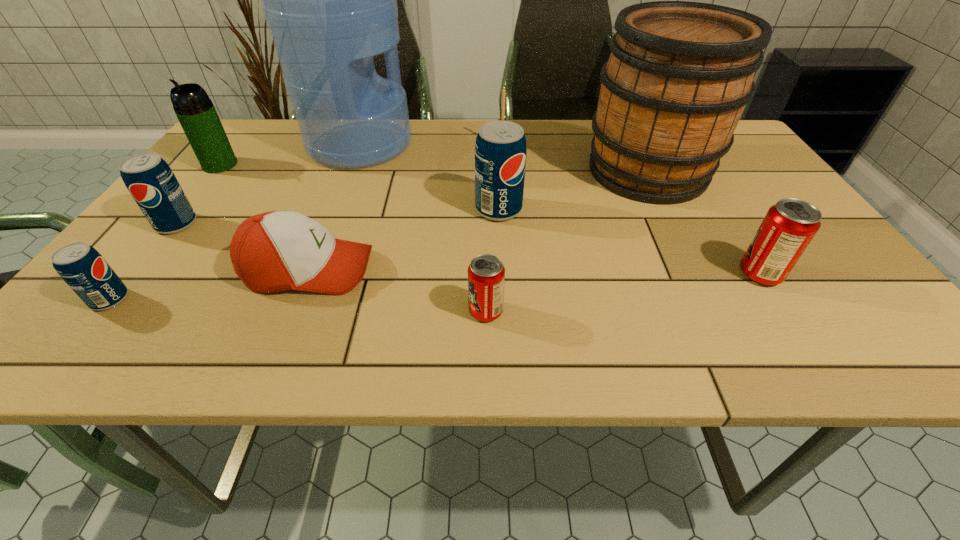
Choose which soda can is the third nearest neighbor to the rightmost blue pop. Please provide its 2D coordinates. Your answer should be formatted as a tuple, i.e. [(x, y)], where the tuple contains the x and y coordinates of a point satisfying the conditions above.

[(149, 179)]

Choose which soda can is the third nearest neighbor to the orange baseball cap. Please provide its 2D coordinates. Your answer should be formatted as a tuple, i.e. [(x, y)], where the tuple contains the x and y coordinates of a point satisfying the conditions above.

[(486, 274)]

You are a GUI agent. You are given a task and a screenshot of the screen. Output one action in this format:
    pyautogui.click(x=<x>, y=<y>)
    Task: Click on the second closest blue pop relative to the second tallest object
    This screenshot has width=960, height=540.
    Given the screenshot: What is the action you would take?
    pyautogui.click(x=149, y=179)

Identify which blue pop is located as the nearest to the biggest blue pop. Please provide its 2D coordinates. Your answer should be formatted as a tuple, i.e. [(x, y)], where the tuple contains the x and y coordinates of a point satisfying the conditions above.

[(149, 179)]

What are the coordinates of `vacant space that satisfies the following two spatial constraints: 1. on the front-facing side of the orange baseball cap; 2. on the left side of the farther red soda can` in the screenshot? It's located at (307, 274).

The width and height of the screenshot is (960, 540). In order to click on blank area in the image that satisfies the following two spatial constraints: 1. on the back side of the smallest blue pop; 2. on the left side of the seventh shortest object in this screenshot , I will do `click(181, 210)`.

The width and height of the screenshot is (960, 540). Identify the location of free spot that satisfies the following two spatial constraints: 1. on the front-facing side of the orange baseball cap; 2. on the left side of the bigger red soda can. (307, 274).

The height and width of the screenshot is (540, 960). Find the location of `vacant space that satisfies the following two spatial constraints: 1. on the front side of the second smallest blue pop; 2. on the left side of the nearer red soda can`. vacant space that satisfies the following two spatial constraints: 1. on the front side of the second smallest blue pop; 2. on the left side of the nearer red soda can is located at coordinates (108, 311).

Where is `free space that satisfies the following two spatial constraints: 1. on the front side of the bigger red soda can; 2. on the left side of the second biggest blue pop`? The width and height of the screenshot is (960, 540). free space that satisfies the following two spatial constraints: 1. on the front side of the bigger red soda can; 2. on the left side of the second biggest blue pop is located at coordinates (137, 274).

You are a GUI agent. You are given a task and a screenshot of the screen. Output one action in this format:
    pyautogui.click(x=<x>, y=<y>)
    Task: Click on the free spot that satisfies the following two spatial constraints: 1. on the back side of the second smallest blue pop; 2. on the right side of the tallest soda can
    The height and width of the screenshot is (540, 960).
    Given the screenshot: What is the action you would take?
    pyautogui.click(x=188, y=210)